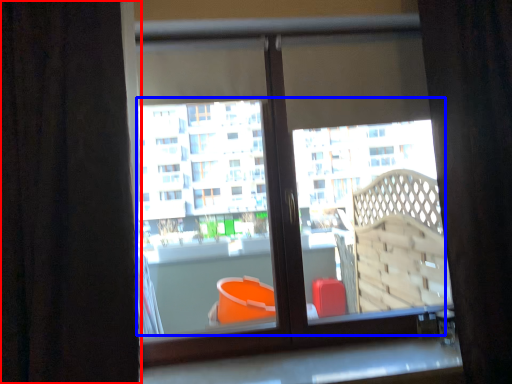
Question: Which point is closer to the camera, curtain (highlighted by a red box) or bay window (highlighted by a blue box)?

Choices:
 (A) curtain
 (B) bay window

Answer: (A)